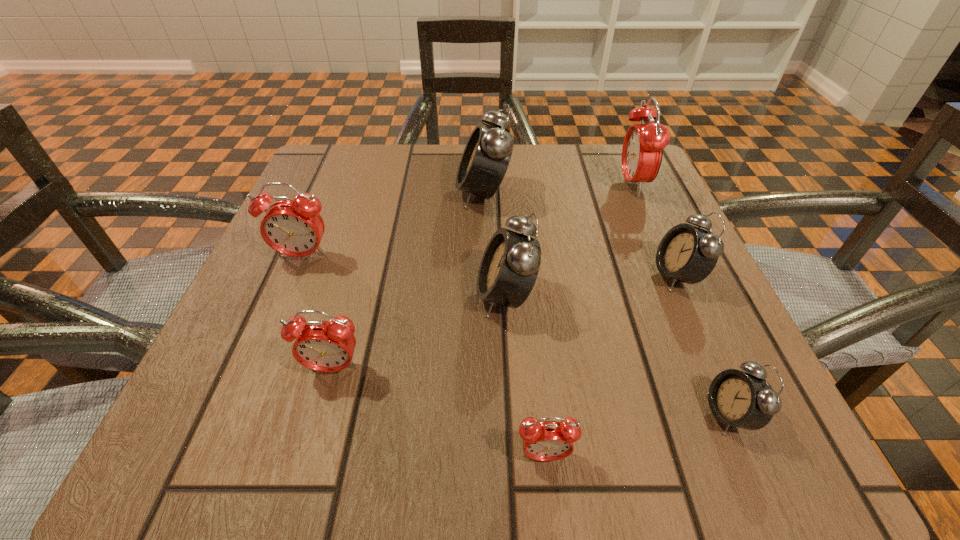
At what (x,y) coordinates should I click in order to perform the action: click on the farthest red alarm clock. Please return your answer as a coordinate pair (x, y). The height and width of the screenshot is (540, 960). Looking at the image, I should click on (643, 145).

Where is `the biggest red alarm clock`? This screenshot has width=960, height=540. the biggest red alarm clock is located at coordinates [x=643, y=145].

This screenshot has height=540, width=960. I want to click on the farthest white alarm clock, so click(486, 157).

Find the location of `the second biggest white alarm clock`. the second biggest white alarm clock is located at coordinates (510, 264).

Image resolution: width=960 pixels, height=540 pixels. Identify the location of the leftmost alarm clock. (294, 228).

This screenshot has width=960, height=540. I want to click on the leftmost object, so click(x=294, y=228).

Identify the location of the third biggest white alarm clock. (686, 253).

Identify the location of the third nearest object. The height and width of the screenshot is (540, 960). (326, 346).

Identify the location of the second object from left to right. The image size is (960, 540). (326, 346).

Identify the location of the smallest white alarm clock. This screenshot has height=540, width=960. (745, 400).